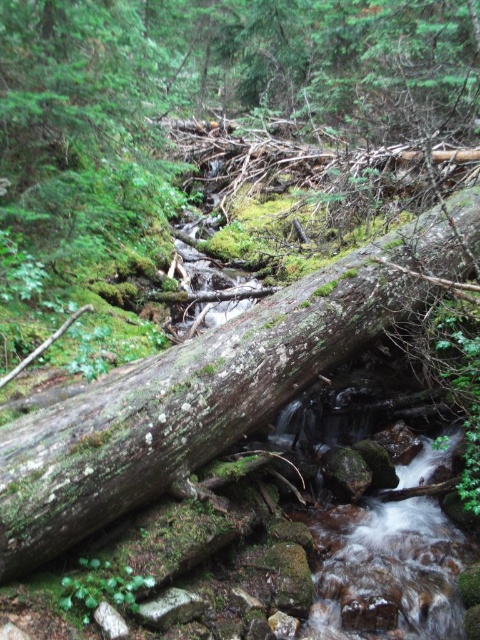
Question: Does green mossy log at center appear on the right side of clear water at stream center?

Choices:
 (A) yes
 (B) no

Answer: (B)

Question: Can you confirm if green mossy log at center is bigger than clear water at stream center?

Choices:
 (A) yes
 (B) no

Answer: (A)

Question: Which object is closer to the camera taking this photo?

Choices:
 (A) green mossy log at center
 (B) clear water at stream center

Answer: (A)

Question: Which point appears farthest from the camera in this image?

Choices:
 (A) (313, 330)
 (B) (400, 577)

Answer: (A)

Question: Can you confirm if green mossy log at center is smaller than clear water at stream center?

Choices:
 (A) no
 (B) yes

Answer: (A)